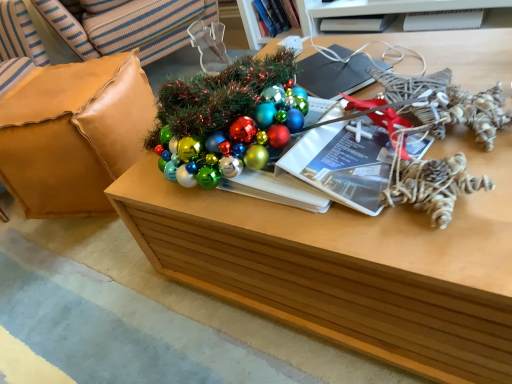
The image size is (512, 384). Identify the location of free location in front of leather cushion at left. (67, 271).